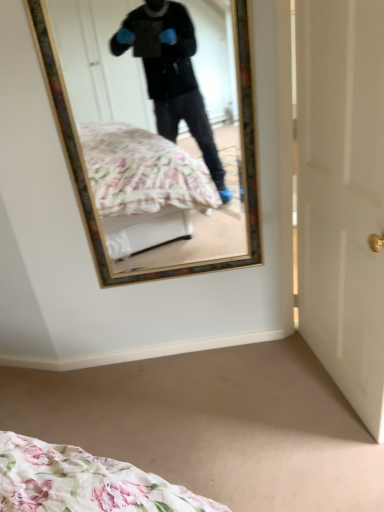
Question: Is wooden-framed mirror at upper center at the back of white glossy door at right?

Choices:
 (A) yes
 (B) no

Answer: (A)

Question: Is white glossy door at right at the right side of wooden-framed mirror at upper center?

Choices:
 (A) no
 (B) yes

Answer: (B)

Question: Is white glossy door at right facing towards wooden-framed mirror at upper center?

Choices:
 (A) yes
 (B) no

Answer: (B)

Question: Can you confirm if white glossy door at right is smaller than wooden-framed mirror at upper center?

Choices:
 (A) no
 (B) yes

Answer: (A)

Question: Is the position of white glossy door at right less distant than that of wooden-framed mirror at upper center?

Choices:
 (A) no
 (B) yes

Answer: (B)

Question: From the image's perspective, is white glossy door at right located beneath wooden-framed mirror at upper center?

Choices:
 (A) yes
 (B) no

Answer: (A)

Question: Considering the relative sizes of wooden-framed mirror at upper center and white glossy door at right in the image provided, is wooden-framed mirror at upper center smaller than white glossy door at right?

Choices:
 (A) yes
 (B) no

Answer: (A)

Question: From the image's perspective, is wooden-framed mirror at upper center on top of white glossy door at right?

Choices:
 (A) yes
 (B) no

Answer: (A)

Question: Is the depth of wooden-framed mirror at upper center greater than that of white glossy door at right?

Choices:
 (A) no
 (B) yes

Answer: (B)

Question: Is wooden-framed mirror at upper center to the right of white glossy door at right from the viewer's perspective?

Choices:
 (A) no
 (B) yes

Answer: (A)

Question: Is wooden-framed mirror at upper center outside white glossy door at right?

Choices:
 (A) no
 (B) yes

Answer: (B)

Question: Is wooden-framed mirror at upper center shorter than white glossy door at right?

Choices:
 (A) yes
 (B) no

Answer: (A)

Question: Considering the positions of white glossy door at right and wooden-framed mirror at upper center in the image, is white glossy door at right taller or shorter than wooden-framed mirror at upper center?

Choices:
 (A) tall
 (B) short

Answer: (A)